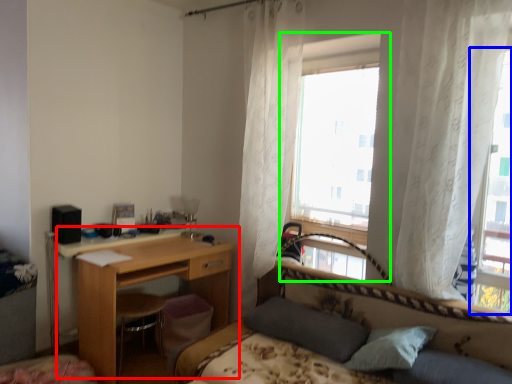
Question: Estimate the real-world distances between objects in this image. Which object is farther from desk (highlighted by a red box), window (highlighted by a blue box) or window (highlighted by a green box)?

Choices:
 (A) window
 (B) window

Answer: (A)